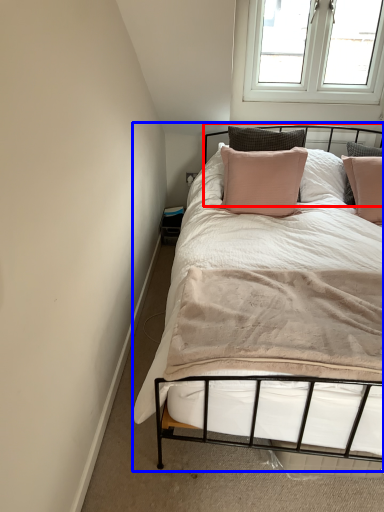
Question: Which of the following is the closest to the observer, headboard (highlighted by a red box) or bed (highlighted by a blue box)?

Choices:
 (A) headboard
 (B) bed

Answer: (B)